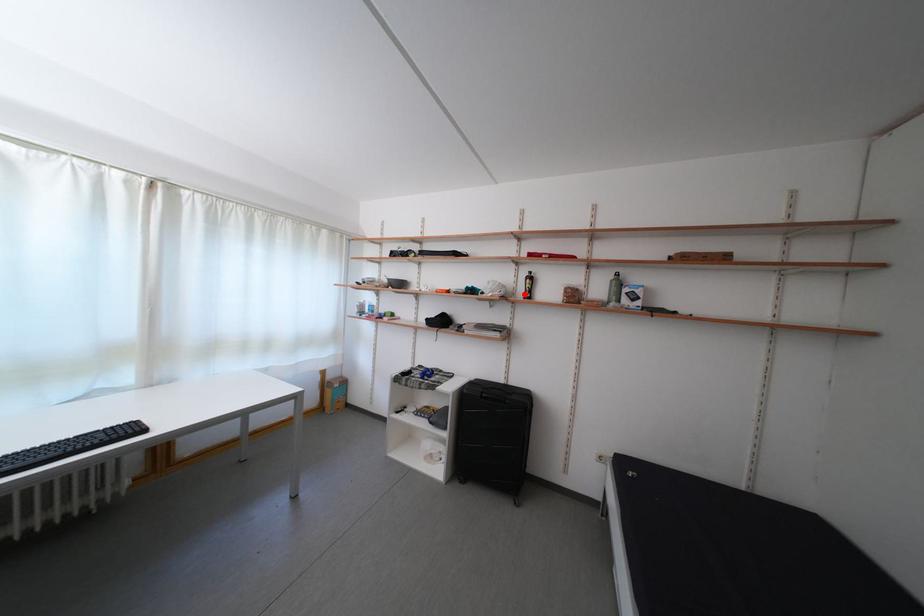
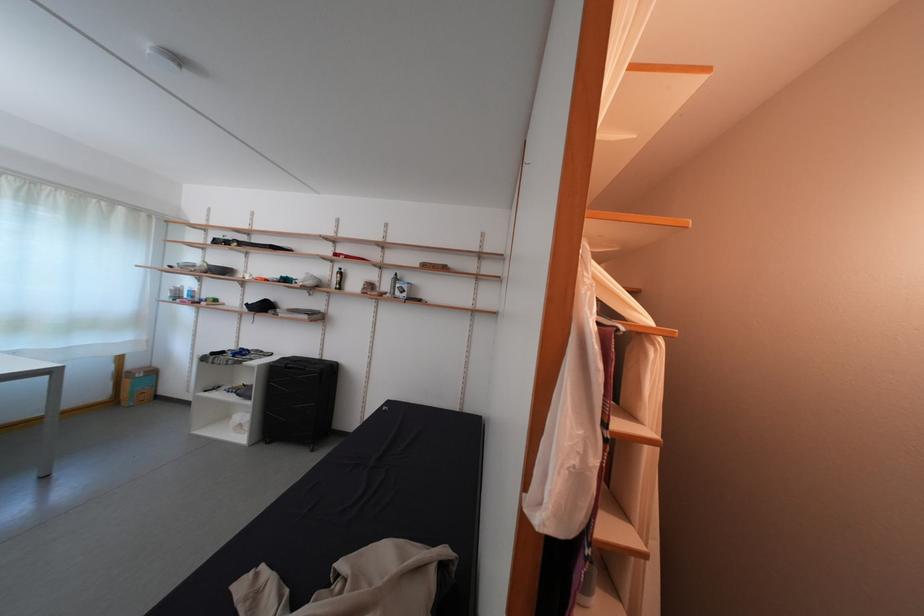
The point at the highlighted location is marked in the first image. Where is the corresponding point in the second image?

(339, 286)